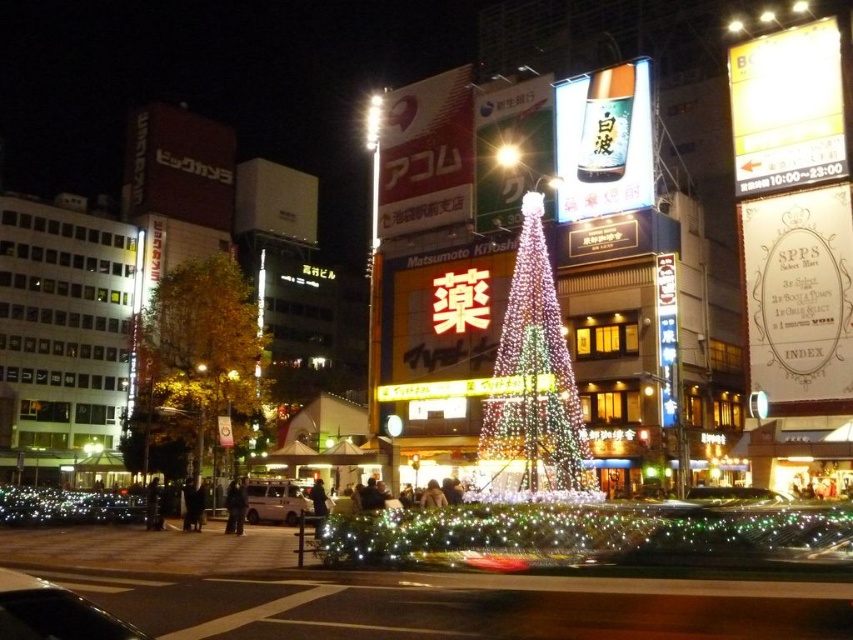
You are a photographer standing at the edge of the square. You want to take a photo of both the metallic silver car at lower left and the shiny silver car at center in the same frame. Given that your camera has a maximum zoom range of 50 meters, will you be able to capture both cars in the same shot?

The metallic silver car at lower left is 46.09 meters away from the shiny silver car at center. Since the distance between them is within the camera maximum zoom range of 50 meters, you can capture both cars in the same shot.

You are standing in the urban night scene described. There is a point marked at coordinates (196, 358). What color are the leaves located at that point?

The leaves at point (196, 358) are yellow or golden in color.